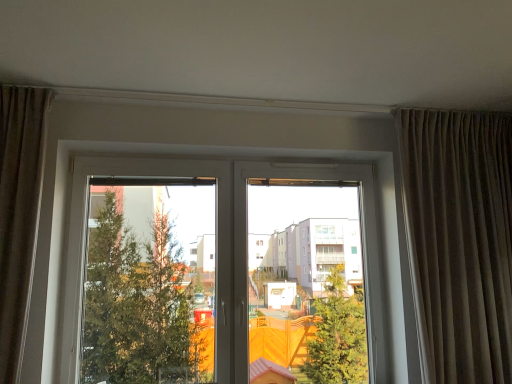
Question: Is brown textured curtain at right positioned in front of transparent glass window at center?

Choices:
 (A) yes
 (B) no

Answer: (A)

Question: Is brown textured curtain at right in contact with transparent glass window at center?

Choices:
 (A) no
 (B) yes

Answer: (A)

Question: From the image's perspective, would you say brown textured curtain at right is shown under transparent glass window at center?

Choices:
 (A) yes
 (B) no

Answer: (B)

Question: Does brown textured curtain at right appear on the right side of transparent glass window at center?

Choices:
 (A) yes
 (B) no

Answer: (A)

Question: Is brown textured curtain at right positioned with its back to transparent glass window at center?

Choices:
 (A) no
 (B) yes

Answer: (A)

Question: Would you say brown textured curtain at right contains transparent glass window at center?

Choices:
 (A) no
 (B) yes

Answer: (A)

Question: Is transparent glass window at center further to camera compared to brown textured curtain at right?

Choices:
 (A) no
 (B) yes

Answer: (B)

Question: From a real-world perspective, does transparent glass window at center sit lower than brown textured curtain at right?

Choices:
 (A) no
 (B) yes

Answer: (B)

Question: Is transparent glass window at center taller than brown textured curtain at right?

Choices:
 (A) no
 (B) yes

Answer: (A)

Question: Would you say transparent glass window at center is outside brown textured curtain at right?

Choices:
 (A) yes
 (B) no

Answer: (A)

Question: Can you confirm if transparent glass window at center is bigger than brown textured curtain at right?

Choices:
 (A) no
 (B) yes

Answer: (B)

Question: Is transparent glass window at center wider than brown textured curtain at right?

Choices:
 (A) yes
 (B) no

Answer: (B)

Question: Would you say brown textured curtain at right is to the left or to the right of transparent glass window at center in the picture?

Choices:
 (A) right
 (B) left

Answer: (A)